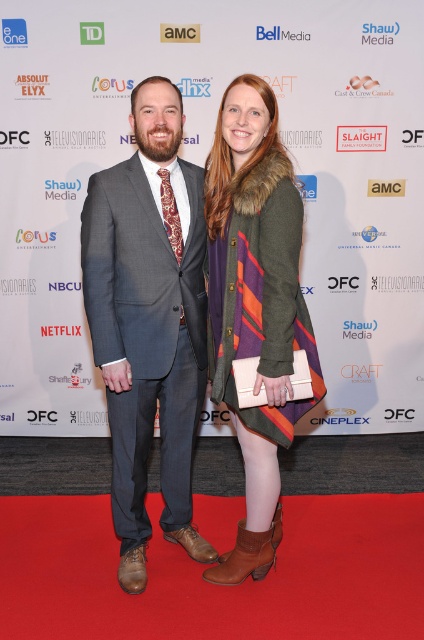
Question: Which object is farther from the camera taking this photo?

Choices:
 (A) gray textured suit at center
 (B) striped wool coat at center

Answer: (A)

Question: Is gray textured suit at center bigger than striped wool coat at center?

Choices:
 (A) yes
 (B) no

Answer: (A)

Question: Does gray textured suit at center appear on the left side of striped wool coat at center?

Choices:
 (A) yes
 (B) no

Answer: (A)

Question: Does gray textured suit at center have a lesser width compared to striped wool coat at center?

Choices:
 (A) no
 (B) yes

Answer: (A)